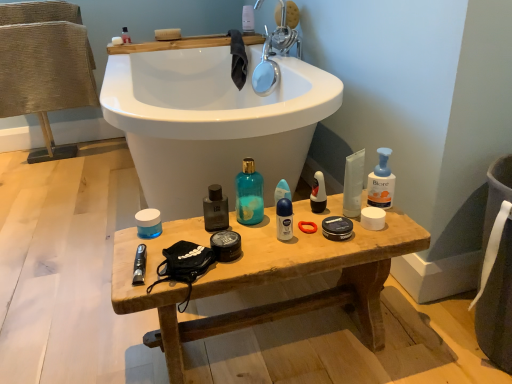
The width and height of the screenshot is (512, 384). What are the coordinates of `free space in front of blue matte deodorant stick at center, arranged as the 6th toiletry when viewed from the left` in the screenshot? It's located at (287, 240).